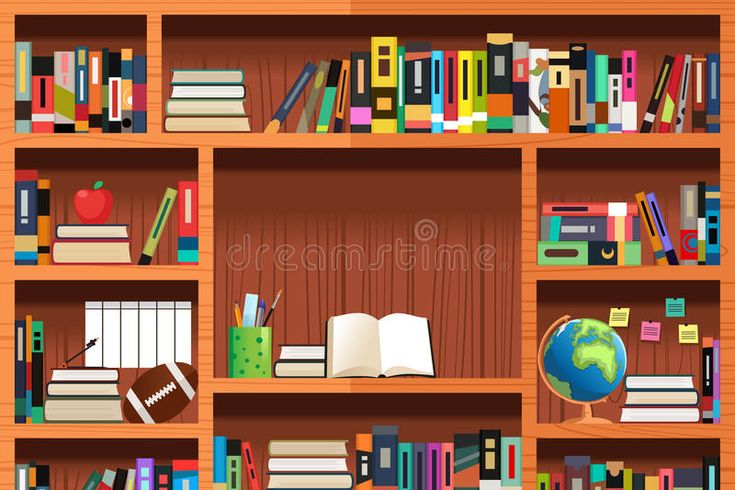
This screenshot has width=735, height=490. Identify the location of shelves. (132, 431), (129, 266), (106, 136), (450, 135), (473, 380), (627, 430), (592, 274).